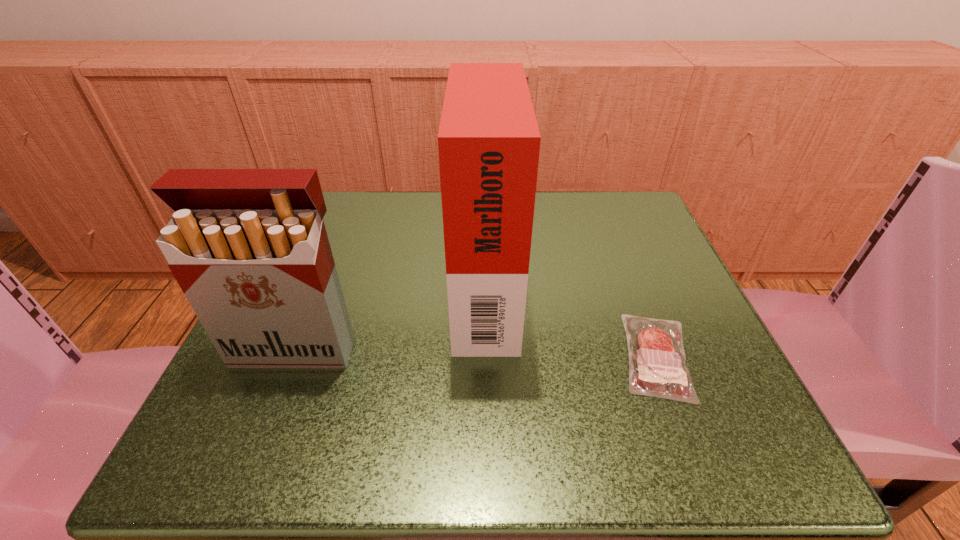
This screenshot has height=540, width=960. Find the location of `the closest object to the steak`. the closest object to the steak is located at coordinates (488, 141).

Where is `vacant space that satisfies the following two spatial constraints: 1. on the front-facing side of the taller cigarette case; 2. with the lid open on the second tallest object`? Image resolution: width=960 pixels, height=540 pixels. vacant space that satisfies the following two spatial constraints: 1. on the front-facing side of the taller cigarette case; 2. with the lid open on the second tallest object is located at coordinates (486, 348).

Where is `free space that satisfies the following two spatial constraints: 1. on the back side of the shortest object; 2. on the front-facing side of the second object from right to left`? free space that satisfies the following two spatial constraints: 1. on the back side of the shortest object; 2. on the front-facing side of the second object from right to left is located at coordinates (630, 285).

The width and height of the screenshot is (960, 540). Find the location of `vacant space that satisfies the following two spatial constraints: 1. on the front-facing side of the shortest object; 2. on the left side of the tallest object`. vacant space that satisfies the following two spatial constraints: 1. on the front-facing side of the shortest object; 2. on the left side of the tallest object is located at coordinates (486, 356).

Where is `free spot that satisfies the following two spatial constraints: 1. on the front-facing side of the taller cigarette case; 2. with the lid open on the second tallest object`? The image size is (960, 540). free spot that satisfies the following two spatial constraints: 1. on the front-facing side of the taller cigarette case; 2. with the lid open on the second tallest object is located at coordinates [486, 348].

Identify the location of vacant space that satisfies the following two spatial constraints: 1. on the front-facing side of the taller cigarette case; 2. with the lid open on the second tallest object. Image resolution: width=960 pixels, height=540 pixels. (486, 348).

Identify the location of free space in the image that satisfies the following two spatial constraints: 1. on the front-facing side of the tallest object; 2. on the right side of the shortest object. This screenshot has height=540, width=960. (486, 356).

Identify the location of free point that satisfies the following two spatial constraints: 1. on the front-facing side of the rightmost object; 2. on the left side of the taller cigarette case. This screenshot has width=960, height=540. (486, 356).

The image size is (960, 540). Find the location of `vacant region that satisfies the following two spatial constraints: 1. on the back side of the steak; 2. on the front-facing side of the tallest object`. vacant region that satisfies the following two spatial constraints: 1. on the back side of the steak; 2. on the front-facing side of the tallest object is located at coordinates tap(630, 285).

Locate an element on the screen. The image size is (960, 540). free region that satisfies the following two spatial constraints: 1. on the front-facing side of the taller cigarette case; 2. on the right side of the rightmost object is located at coordinates point(486,356).